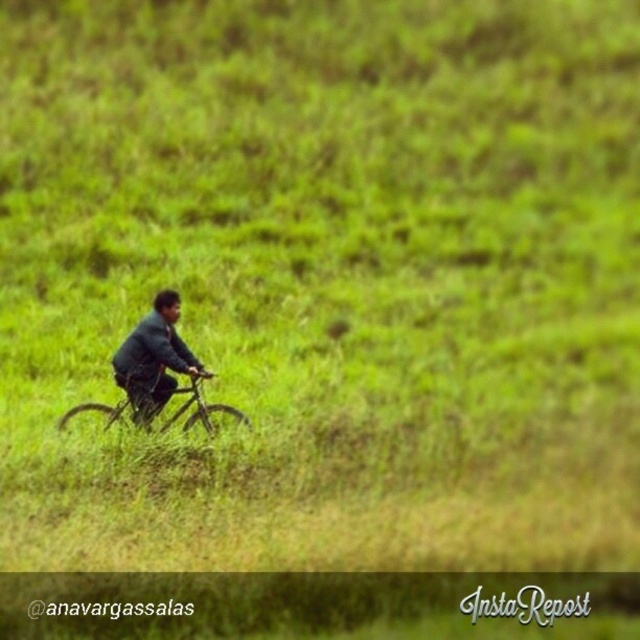
Question: Which point is closer to the camera?

Choices:
 (A) dark blue fabric jacket at center
 (B) metallic silver mountain bike at center

Answer: (A)

Question: Observing the image, what is the correct spatial positioning of dark blue fabric jacket at center in reference to metallic silver mountain bike at center?

Choices:
 (A) left
 (B) right

Answer: (B)

Question: Which point is farther from the camera taking this photo?

Choices:
 (A) (202, 368)
 (B) (202, 397)

Answer: (B)

Question: Does dark blue fabric jacket at center lie in front of metallic silver mountain bike at center?

Choices:
 (A) no
 (B) yes

Answer: (B)

Question: Can you confirm if dark blue fabric jacket at center is positioned below metallic silver mountain bike at center?

Choices:
 (A) no
 (B) yes

Answer: (A)